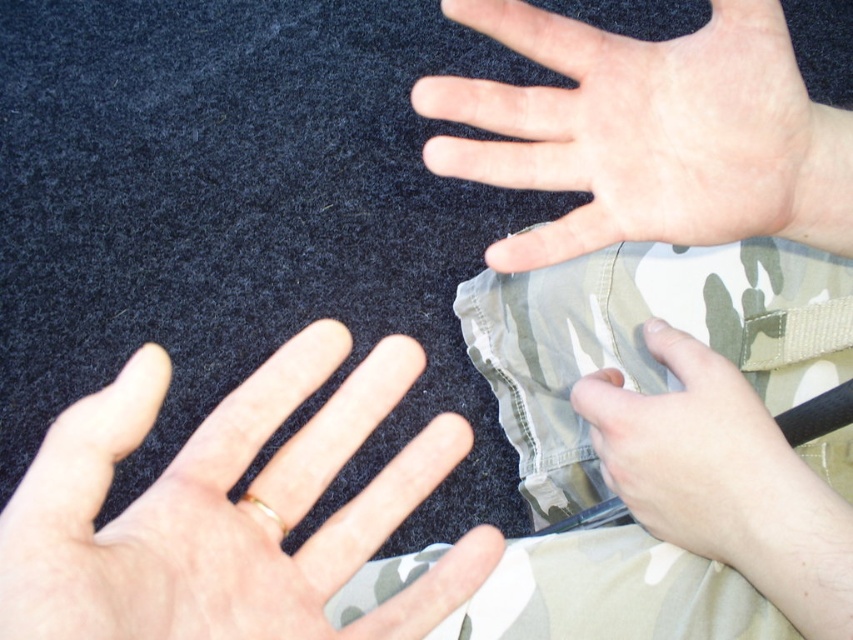
You are designing a poster and need to know which element takes up more vertical space in the image. The elements are the camouflage fabric pants at center and the pale skin at center. Which one is taller?

The camouflage fabric pants at center has a greater height compared to the pale skin at center, so the camouflage fabric pants at center is taller.

You are a photographer adjusting the lighting in a studio setup. You notice two points of light reflected on the dark surface in the scene. The points are labeled as point (576, 598) and point (508, 108). Based on their positions, which point is closer to the camera?

Point (508, 108) is closer to the camera because point (576, 598) is behind it according to the spatial arrangement.